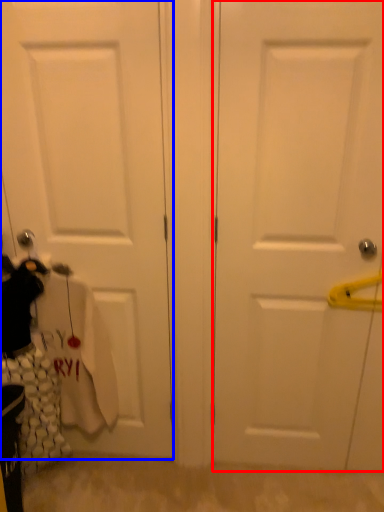
Question: Among these objects, which one is nearest to the camera, door (highlighted by a red box) or door (highlighted by a blue box)?

Choices:
 (A) door
 (B) door

Answer: (A)